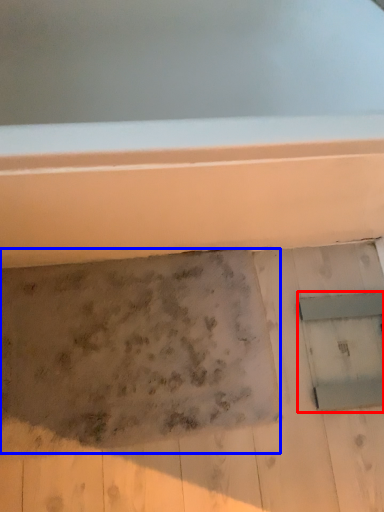
Question: Which object is closer to the camera taking this photo, window (highlighted by a red box) or footprint (highlighted by a blue box)?

Choices:
 (A) window
 (B) footprint

Answer: (B)